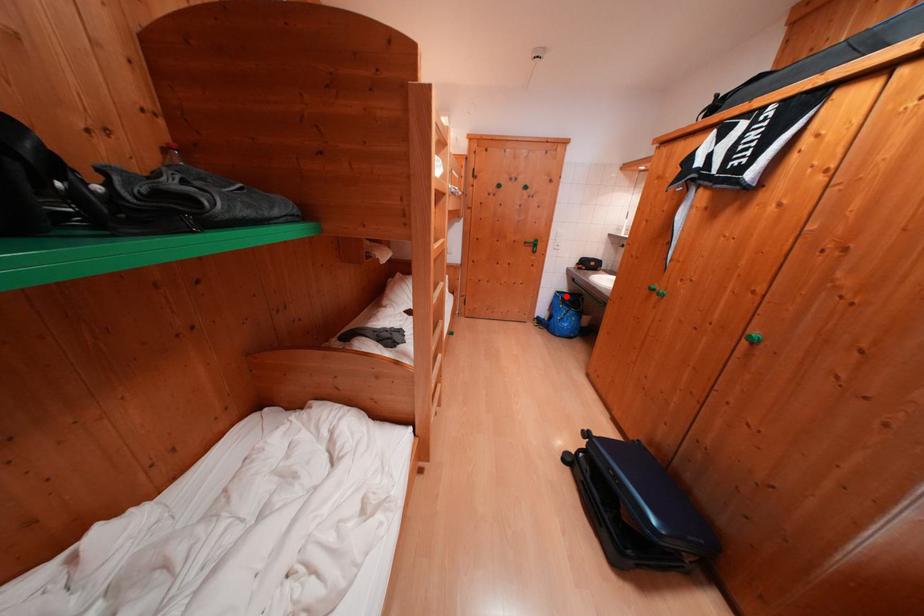
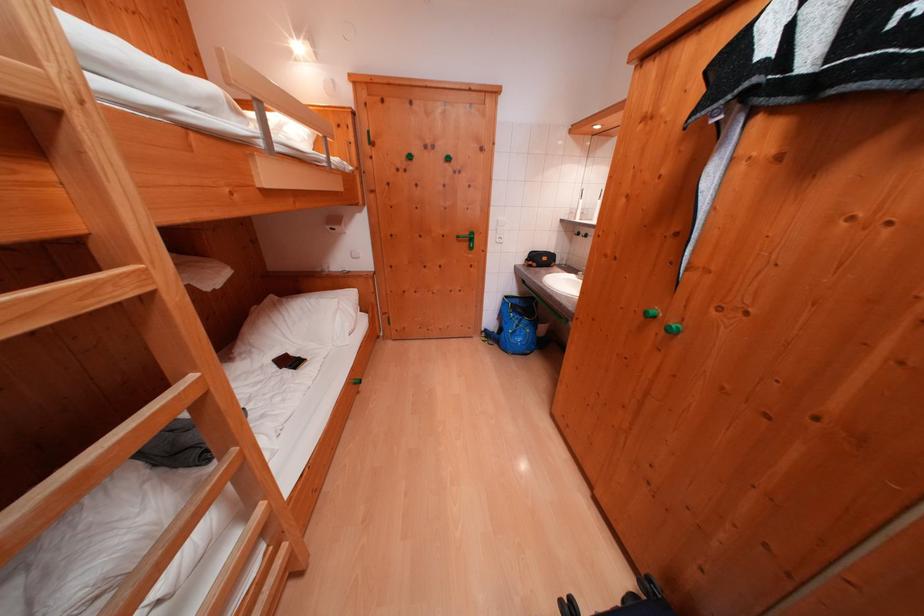
The point at the highlighted location is marked in the first image. Where is the corresponding point in the second image?

(515, 301)